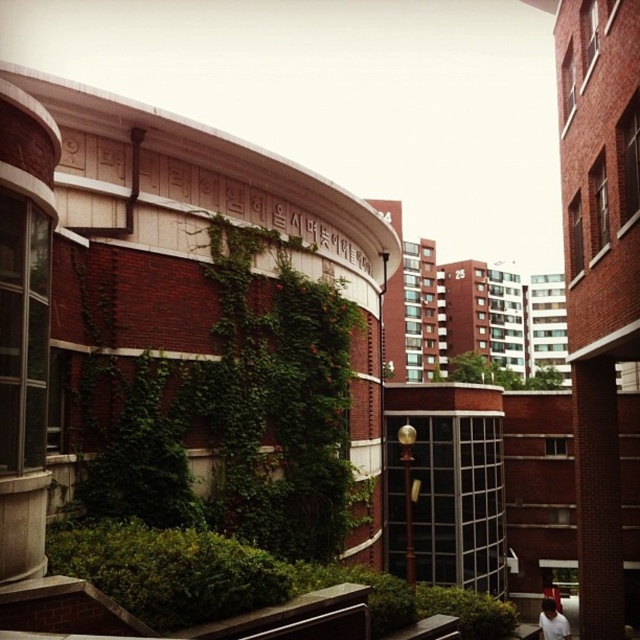
You are standing at the location of the white cotton shirt at lower right and want to take a photo of the green leafy ivy at center. Given that your camera has a maximum focus range of 60 meters, will you be able to capture the ivy clearly?

The green leafy ivy at center is 64.16 meters away from the white cotton shirt at lower right. Since the camera can only focus up to 60 meters, you won t be able to capture the ivy clearly.

You are standing in the urban area looking at the curved brick building. You see the green leafy ivy at center and the white cotton shirt at lower right. Which object is positioned more to the right side?

The green leafy ivy at center is positioned to the right of the white cotton shirt at lower right, so the ivy is more to the right side.

You are standing at point (497,372) in the image. What do you see directly in front of you?

You see green leafy ivy at center directly in front of you at point 0.588, 0.778.